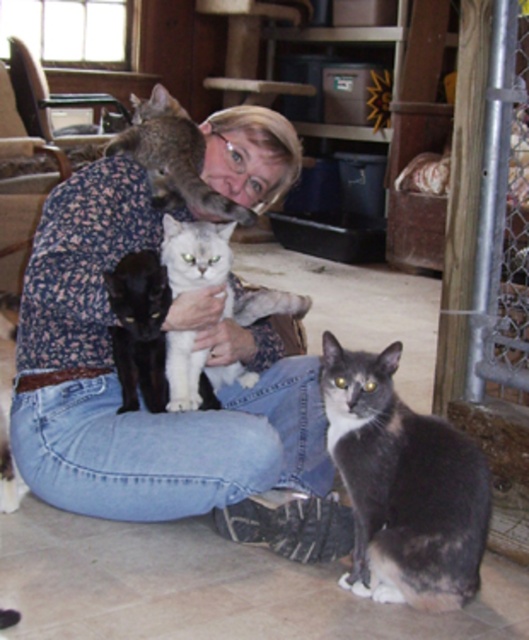
Question: Does gray fur cat at center come behind white fluffy cat at center?

Choices:
 (A) no
 (B) yes

Answer: (A)

Question: Which of the following is the farthest from the observer?

Choices:
 (A) (129, 198)
 (B) (350, 380)

Answer: (A)

Question: Considering the real-world distances, which object is farthest from the gray fur cat at center?

Choices:
 (A) black fur cat at left
 (B) white fluffy cat at center
 (C) fluffy gray cat at upper center

Answer: (C)

Question: Which object is positioned closest to the white fluffy cat at center?

Choices:
 (A) floral print shirt at center
 (B) gray fur cat at center
 (C) fluffy gray cat at upper center

Answer: (A)

Question: Does fluffy gray cat at upper center have a lesser width compared to white fluffy cat at center?

Choices:
 (A) no
 (B) yes

Answer: (A)

Question: Can you confirm if gray fur cat at center is positioned to the right of white fluffy cat at center?

Choices:
 (A) yes
 (B) no

Answer: (A)